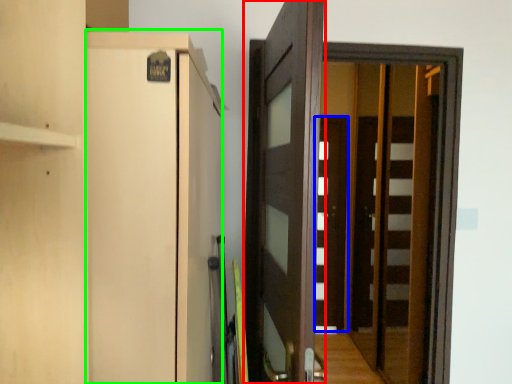
Question: Considering the real-world distances, which object is farthest from door (highlighted by a red box)? door (highlighted by a blue box) or cabinetry (highlighted by a green box)?

Choices:
 (A) door
 (B) cabinetry

Answer: (A)